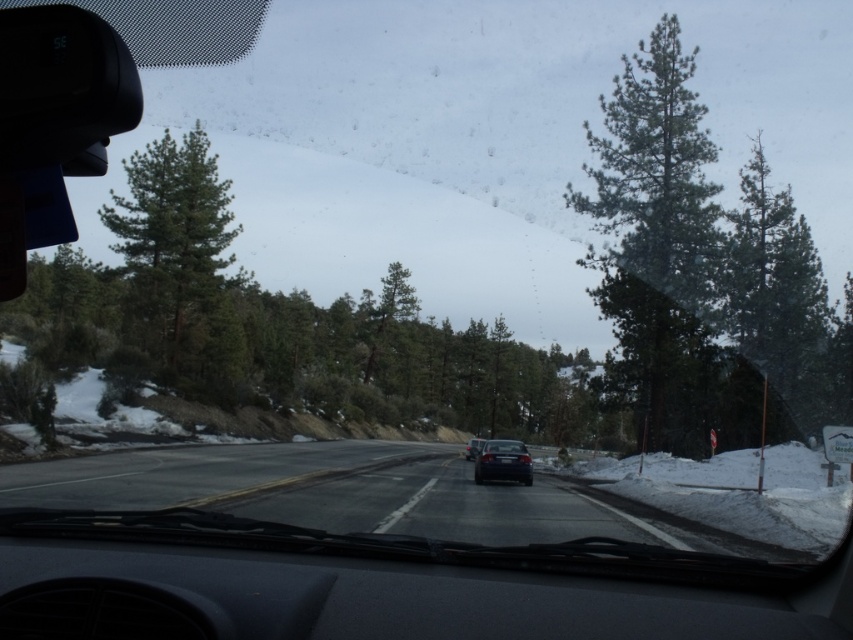
Question: Which object is closer to the camera taking this photo?

Choices:
 (A) green matte tree at left
 (B) glossy black car at center

Answer: (B)

Question: Which of the following is the farthest from the observer?

Choices:
 (A) green matte tree at right
 (B) black asphalt highway at center
 (C) green needle-like tree at right
 (D) black matte sedan at center

Answer: (D)

Question: Observing the image, what is the correct spatial positioning of green matte tree at right in reference to black matte sedan at center?

Choices:
 (A) below
 (B) above

Answer: (B)

Question: Is black asphalt highway at center above green matte tree at left?

Choices:
 (A) no
 (B) yes

Answer: (A)

Question: Considering the real-world distances, which object is closest to the black asphalt highway at center?

Choices:
 (A) green needle-like tree at right
 (B) green matte tree at right

Answer: (B)

Question: Does black asphalt highway at center come in front of glossy black car at center?

Choices:
 (A) yes
 (B) no

Answer: (A)